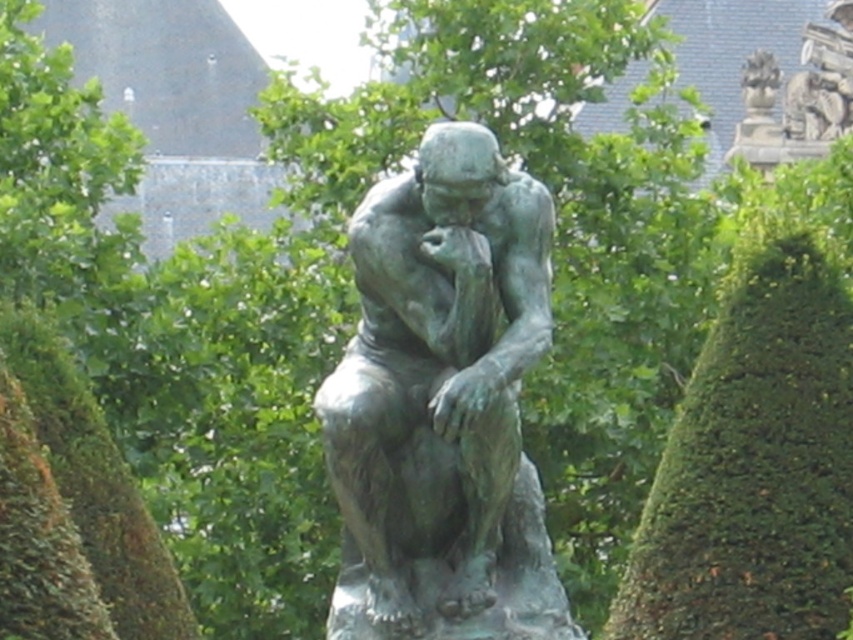
The width and height of the screenshot is (853, 640). I want to click on bronze statue at center, so click(x=444, y=403).

In the scene shown: Is bronze statue at center smaller than bronze statue at upper right?

No.

Find the location of a particular element. Image resolution: width=853 pixels, height=640 pixels. bronze statue at center is located at coordinates (444, 403).

You are a GUI agent. You are given a task and a screenshot of the screen. Output one action in this format:
    pyautogui.click(x=<x>, y=<y>)
    Task: Click on the bronze statue at center
    
    Given the screenshot: What is the action you would take?
    pyautogui.click(x=444, y=403)